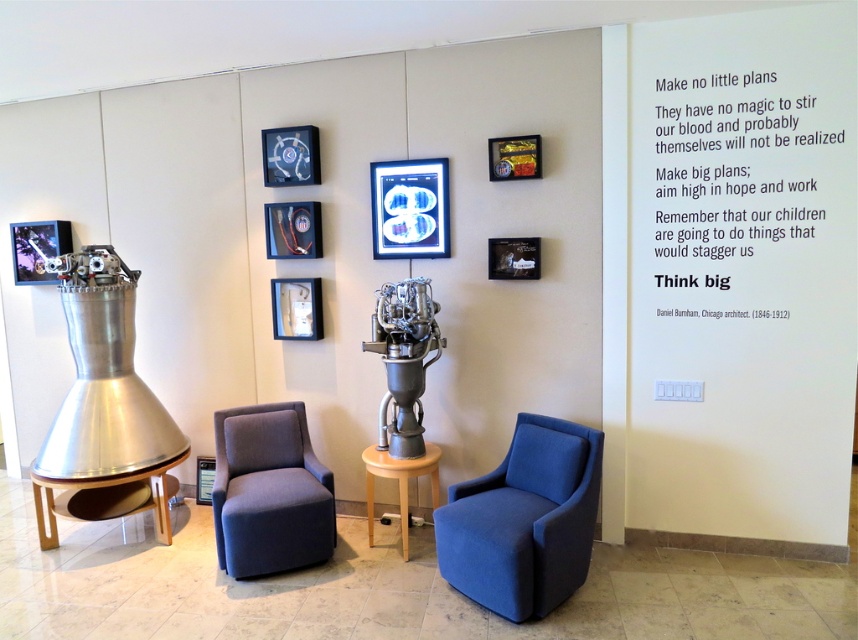
Looking at this image, who is shorter, blue fabric swivel chair at center or metallic/reflective picture frame at lower left?

With less height is metallic/reflective picture frame at lower left.

Image resolution: width=858 pixels, height=640 pixels. What do you see at coordinates (524, 520) in the screenshot? I see `blue fabric swivel chair at center` at bounding box center [524, 520].

Is point (498, 579) less distant than point (209, 486)?

Yes, it is in front of point (209, 486).

Find the location of `blue fabric swivel chair at center`. blue fabric swivel chair at center is located at coordinates (524, 520).

Who is more distant from viewer, (91, 520) or (385, 465)?

The point (91, 520) is more distant.

Does wooden polished table at lower left appear under light wood/finely polished side table at center?

Indeed, wooden polished table at lower left is positioned under light wood/finely polished side table at center.

Which is in front, point (64, 497) or point (369, 512)?

Point (369, 512) is more forward.

Locate an element on the screen. The height and width of the screenshot is (640, 858). wooden polished table at lower left is located at coordinates (107, 499).

Measure the distance from wooden polished table at lower left to metallic/reflective picture frame at lower left.

wooden polished table at lower left and metallic/reflective picture frame at lower left are 20.99 inches apart from each other.

Is point (107, 516) positioned before point (206, 502)?

Yes.

Identify the location of wooden polished table at lower left. (107, 499).